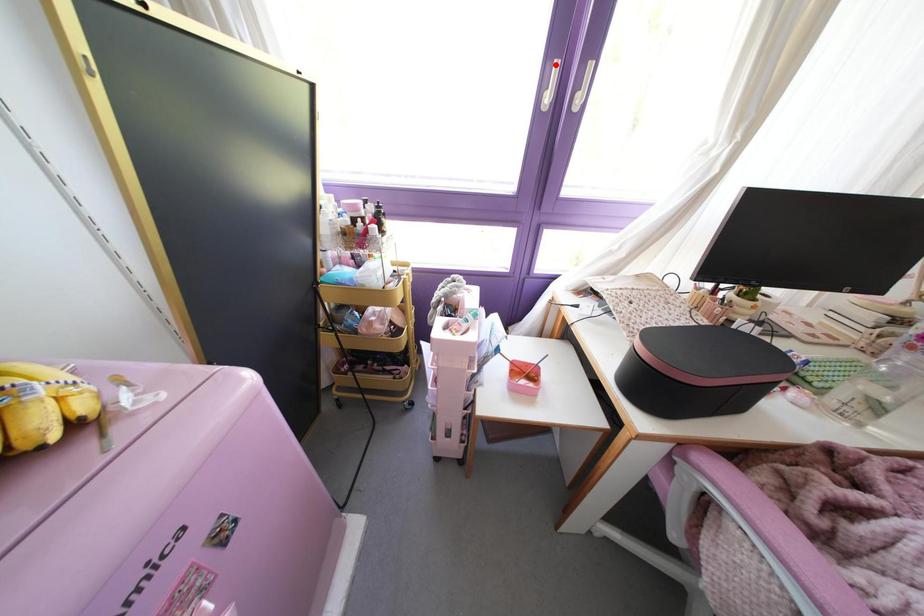
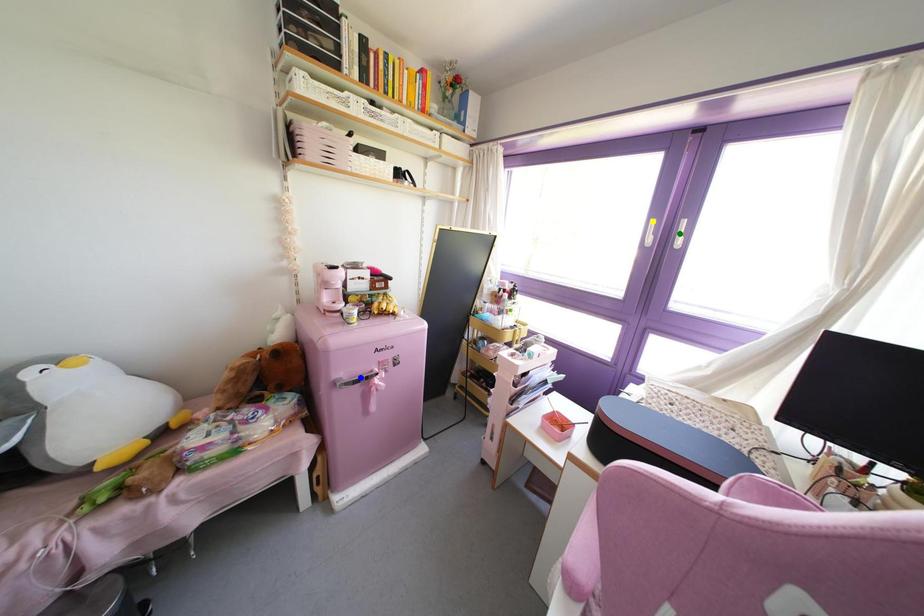
Question: I am providing you with two images of the same scene from different viewpoints. A red point is marked on the first image. You are given multiple points on the second image. Which point in image 2 represents the same 3d spot as the red point in image 1?

Choices:
 (A) green point
 (B) yellow point
 (C) blue point

Answer: (B)